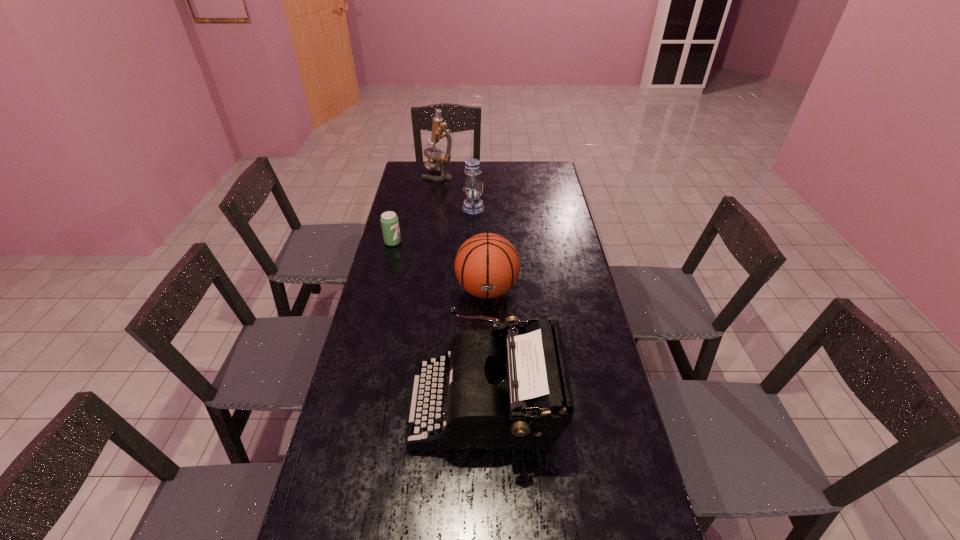
In the image, there is a desktop. Where is `vacant space at the right edge`? vacant space at the right edge is located at coordinates (540, 206).

This screenshot has width=960, height=540. What are the coordinates of `free space between the soda and the second farthest object` in the screenshot? It's located at (433, 225).

Identify the location of empty space that is in between the lantern and the typewriter. (480, 305).

What are the coordinates of `free space between the lantern and the typewriter` in the screenshot? It's located at (480, 305).

The width and height of the screenshot is (960, 540). I want to click on vacant area that lies between the fifth tallest object and the tallest object, so click(416, 208).

The height and width of the screenshot is (540, 960). What are the coordinates of `vacant area between the fourth farthest object and the tallest object` in the screenshot? It's located at (463, 233).

At what (x,y) coordinates should I click in order to perform the action: click on free space between the second nearest object and the fifth tallest object. Please return your answer as a coordinate pair (x, y). The height and width of the screenshot is (540, 960). Looking at the image, I should click on (440, 322).

Where is `free space between the basketball and the tallest object`? The image size is (960, 540). free space between the basketball and the tallest object is located at coordinates (463, 233).

Locate an element on the screen. This screenshot has width=960, height=540. object that is the fourth closest one to the microscope is located at coordinates (517, 396).

Locate which object is the second closest to the fifth nearest object. Please provide its 2D coordinates. Your answer should be formatted as a tuple, i.e. [(x, y)], where the tuple contains the x and y coordinates of a point satisfying the conditions above.

[(389, 220)]